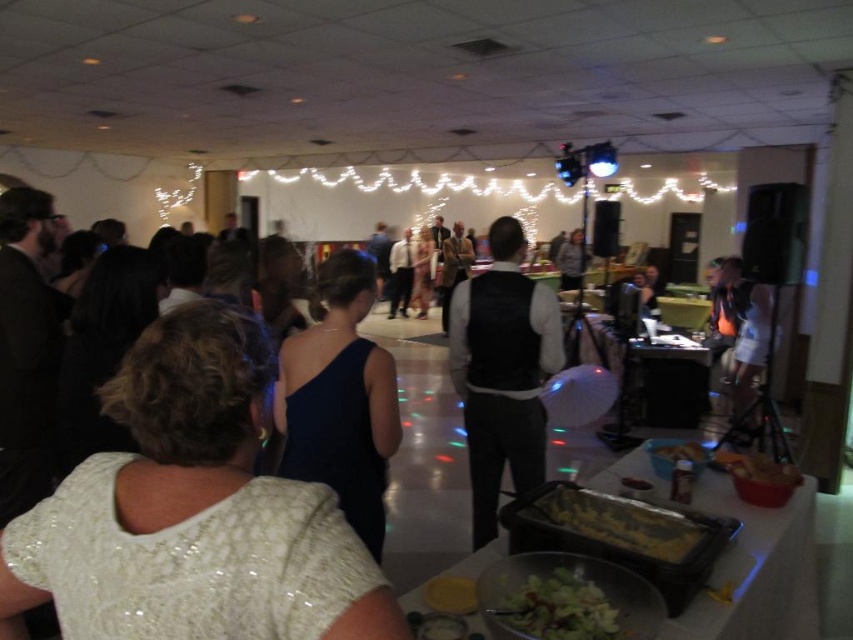
You are standing at the entrance of the event and want to take a photo that includes both the point at [601,525] and the point at [761,292]. Which point should you focus on first to ensure both are in focus?

You should focus on the point at [601,525] first because it is closer to the camera than the point at [761,292]. This ensures the closer point is in focus, and the farther point may also be within the depth of field.

You are a photographer at the event and want to capture a photo of both the yellow matte cake at lower center and the white fabric dress at right in the same frame. Given that your camera has a maximum focal length that allows capturing objects within a 4 meter distance apart, will you be able to include both in a single shot?

The distance between the yellow matte cake at lower center and the white fabric dress at right is 3.87 meters, which is within the camera maximum focal length of 4 meters. Therefore, both can be captured in the same frame.

You are a photographer at the event and want to capture a photo that includes both the white sequined dress at upper left and the black leather vest at center. Which object should you focus on first to ensure both are in sharp focus?

You should focus on the white sequined dress at upper left first because it is closer to the viewer than the black leather vest at center, ensuring both will be in focus when focusing on the closer object.